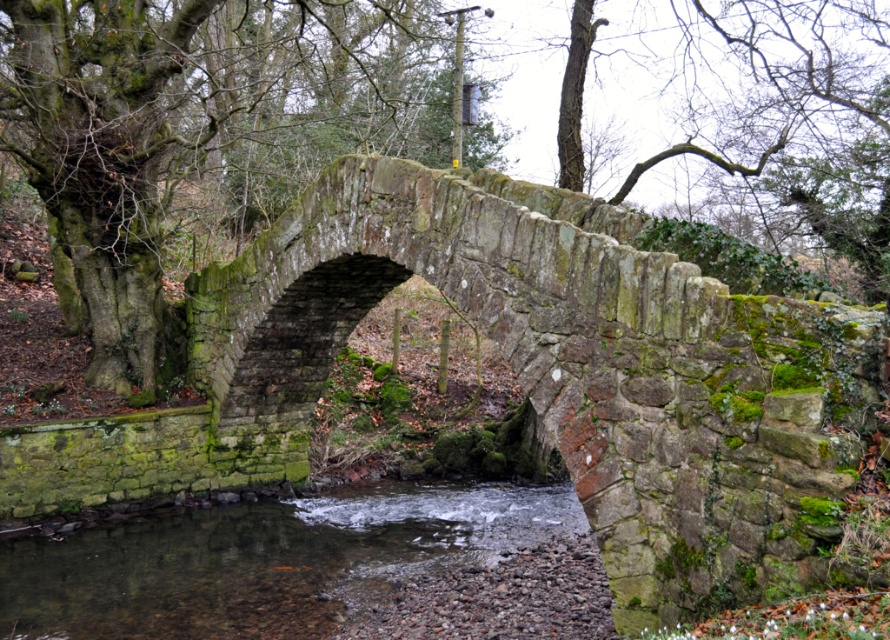
You are a photographer planning to take a wide shot of the green mossy stone bridge at center and the clear water at stream center. Which object will occupy more space in your photo?

The green mossy stone bridge at center is bigger than the clear water at stream center, so it will occupy more space in the photo.

You are standing on the bank of the stream and want to cross to the other side. The green mossy stone bridge at center and clear water at stream center are in your view. Which object is positioned to the right when looking towards the bridge?

The green mossy stone bridge at center is to the right of the clear water at stream center, so when looking towards the bridge, the green mossy stone bridge at center is positioned to the right.